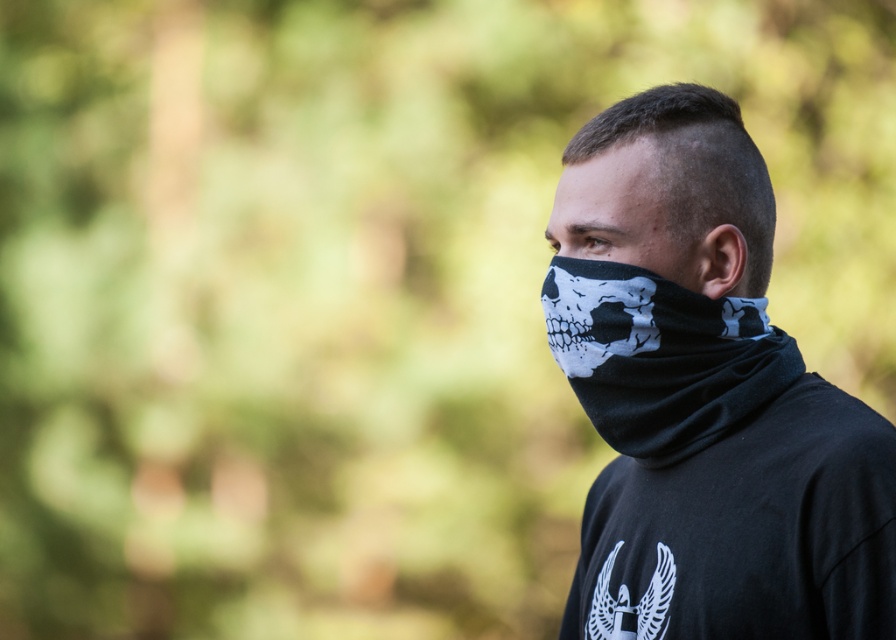
Question: Observing the image, what is the correct spatial positioning of black fabric bandana at right in reference to black matte bandana at center?

Choices:
 (A) right
 (B) left

Answer: (A)

Question: Does black fabric bandana at right have a greater width compared to black matte bandana at center?

Choices:
 (A) yes
 (B) no

Answer: (A)

Question: Does black fabric bandana at right appear on the left side of black matte bandana at center?

Choices:
 (A) no
 (B) yes

Answer: (A)

Question: Which point is closer to the camera taking this photo?

Choices:
 (A) click(x=808, y=573)
 (B) click(x=664, y=193)

Answer: (A)